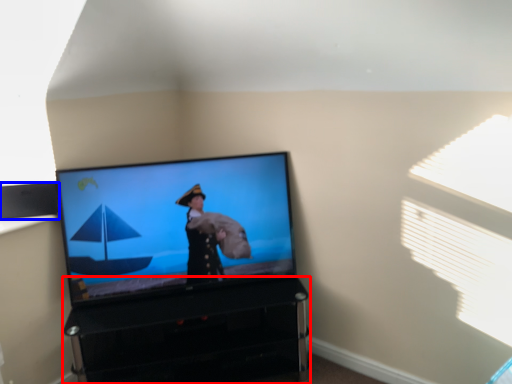
Question: Which object appears closest to the camera in this image, furniture (highlighted by a red box) or speaker (highlighted by a blue box)?

Choices:
 (A) furniture
 (B) speaker

Answer: (A)